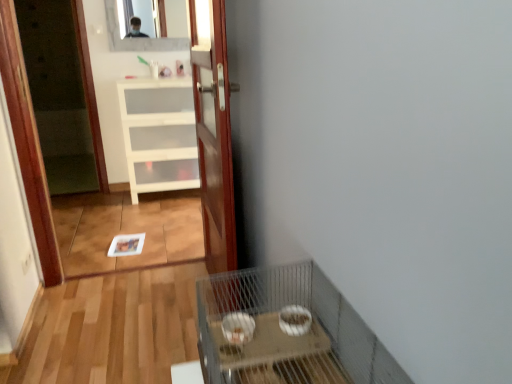
The image size is (512, 384). In order to click on free region on the left part of wooden door at center in this screenshot , I will do `click(130, 310)`.